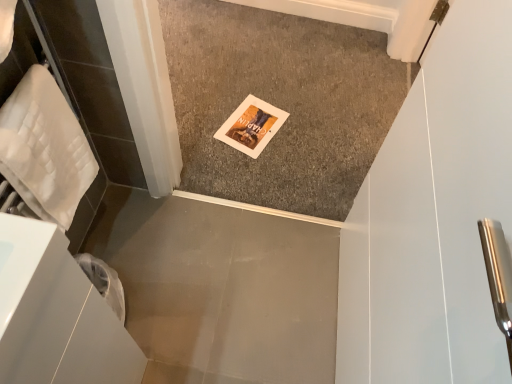
Question: Is white quilted towel at left spatially inside carpeted floor at center, positioned as the first concrete in back-to-front order, or outside of it?

Choices:
 (A) inside
 (B) outside

Answer: (B)

Question: Is white quilted towel at left in front of or behind carpeted floor at center, which ranks as the 2th concrete in bottom-to-top order, in the image?

Choices:
 (A) front
 (B) behind

Answer: (A)

Question: Which is nearer to the white quilted towel at left?

Choices:
 (A) smooth gray concrete at lower left, marked as the second concrete in a back-to-front arrangement
 (B) carpeted floor at center, which ranks as the 2th concrete in bottom-to-top order

Answer: (A)

Question: Which object is the farthest from the carpeted floor at center, positioned as the first concrete in back-to-front order?

Choices:
 (A) smooth gray concrete at lower left, arranged as the 2th concrete when viewed from the top
 (B) white quilted towel at left

Answer: (B)